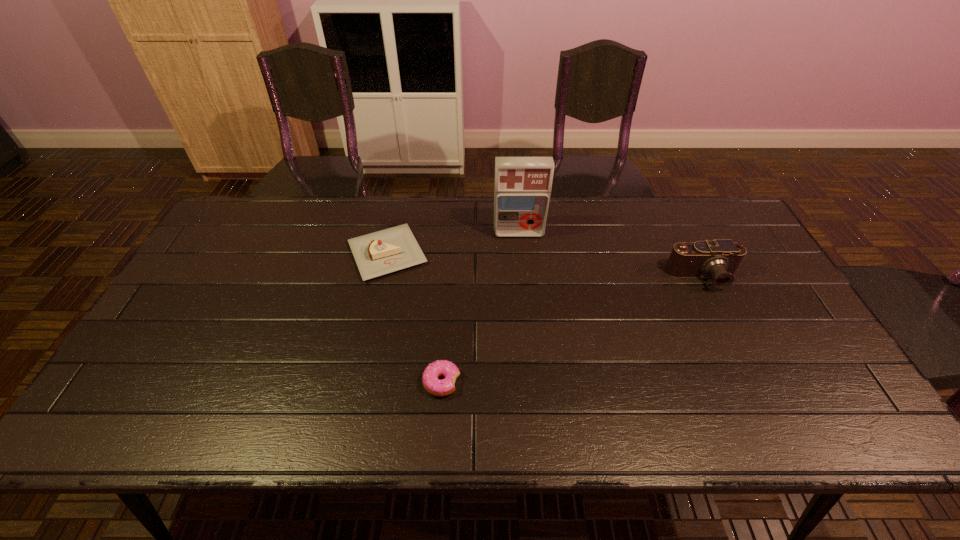
Locate an element on the screen. the third object from left to right is located at coordinates (523, 185).

What are the coordinates of `the first-aid kit` in the screenshot? It's located at (523, 185).

Where is `camera`? The image size is (960, 540). camera is located at coordinates (720, 258).

Locate an element on the screen. This screenshot has height=540, width=960. the third shortest object is located at coordinates (720, 258).

Where is `the third tallest object`? The image size is (960, 540). the third tallest object is located at coordinates (389, 250).

Where is `the leftmost object`? the leftmost object is located at coordinates (389, 250).

The height and width of the screenshot is (540, 960). What are the coordinates of `the nearest object` in the screenshot? It's located at (430, 381).

Identify the location of doughnut. (430, 381).

Locate an element on the screen. The image size is (960, 540). vacant space located on the front-facing side of the first-aid kit is located at coordinates (522, 269).

You are a GUI agent. You are given a task and a screenshot of the screen. Output one action in this format:
    pyautogui.click(x=<x>, y=<y>)
    Task: Click on the vacant point located 0.120m on the front-facing side of the rightmost object
    The width and height of the screenshot is (960, 540).
    Given the screenshot: What is the action you would take?
    pyautogui.click(x=727, y=327)